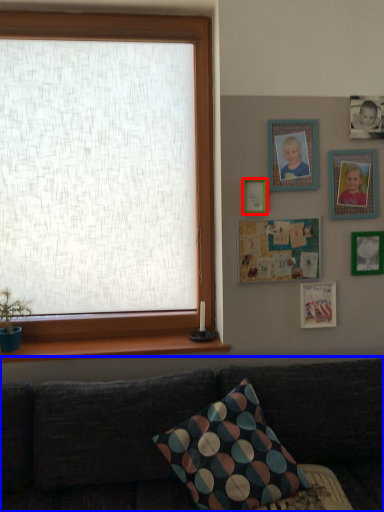
Question: Which object appears closest to the camera in this image, picture frame (highlighted by a red box) or studio couch (highlighted by a blue box)?

Choices:
 (A) picture frame
 (B) studio couch

Answer: (B)